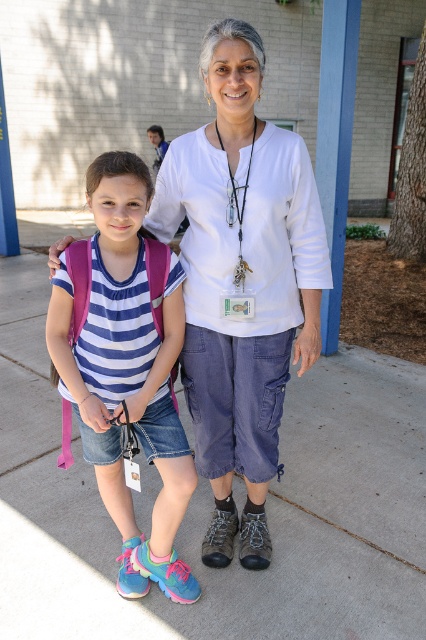
Which of these two, white cotton shirt at center or blue striped shirt at center, stands taller?

white cotton shirt at center is taller.

This screenshot has width=426, height=640. Describe the element at coordinates (241, 282) in the screenshot. I see `white cotton shirt at center` at that location.

Identify the location of white cotton shirt at center. (241, 282).

Who is positioned more to the right, gray concrete pavement at center or white cotton shirt at center?

white cotton shirt at center is more to the right.

Can you confirm if gray concrete pavement at center is bigger than white cotton shirt at center?

Correct, gray concrete pavement at center is larger in size than white cotton shirt at center.

This screenshot has width=426, height=640. Find the location of `gray concrete pavement at center`. gray concrete pavement at center is located at coordinates (212, 508).

Can you confirm if gray concrete pavement at center is shorter than blue striped shirt at center?

Yes.

Is gray concrete pavement at center positioned before blue striped shirt at center?

No.

Between point (409, 472) and point (103, 340), which one is positioned in front?

Point (103, 340) is in front.

At what (x,y) coordinates should I click in order to perform the action: click on gray concrete pavement at center. Please return your answer as a coordinate pair (x, y). Looking at the image, I should click on (212, 508).